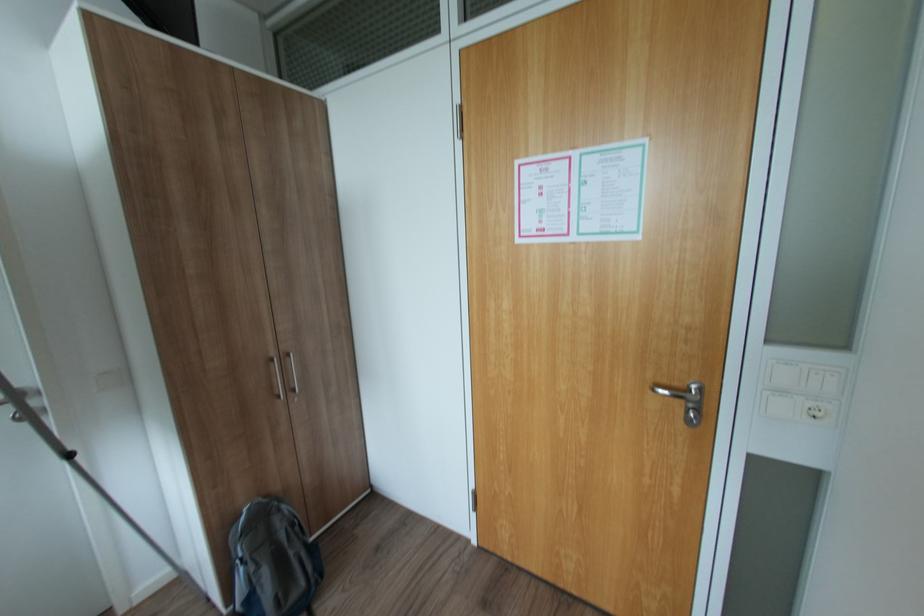
Describe the element at coordinates (819, 411) in the screenshot. I see `the white power outlet` at that location.